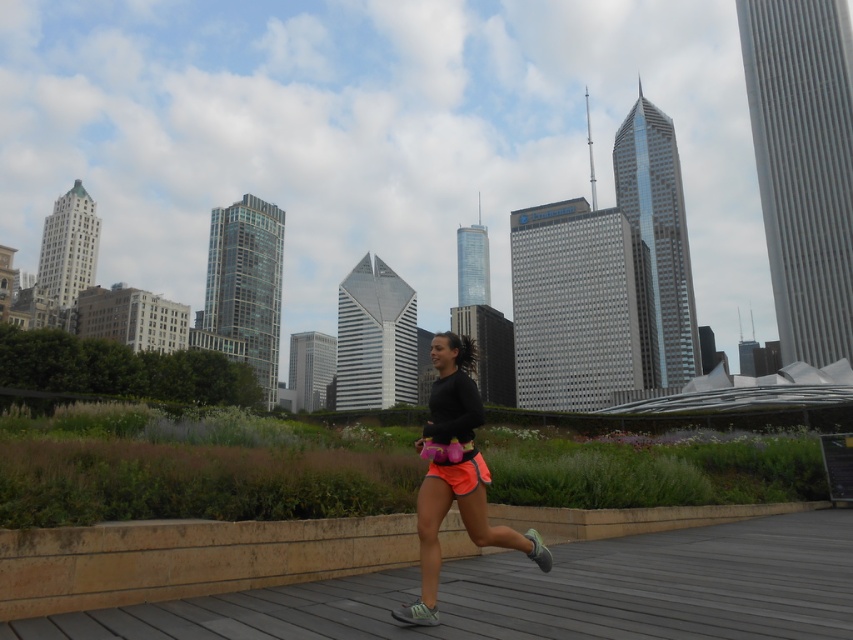
Question: Which point appears closest to the camera in this image?

Choices:
 (A) (453, 472)
 (B) (782, 618)

Answer: (B)

Question: Which of the following is the closest to the observer?

Choices:
 (A) neon orange shorts at center
 (B) wooden deck at center

Answer: (B)

Question: Among these points, which one is nearest to the camera?

Choices:
 (A) (480, 496)
 (B) (805, 563)

Answer: (A)

Question: Is wooden deck at center bigger than neon orange shorts at center?

Choices:
 (A) no
 (B) yes

Answer: (A)

Question: Is wooden deck at center further to camera compared to neon orange shorts at center?

Choices:
 (A) yes
 (B) no

Answer: (B)

Question: Does wooden deck at center have a greater width compared to neon orange shorts at center?

Choices:
 (A) no
 (B) yes

Answer: (B)